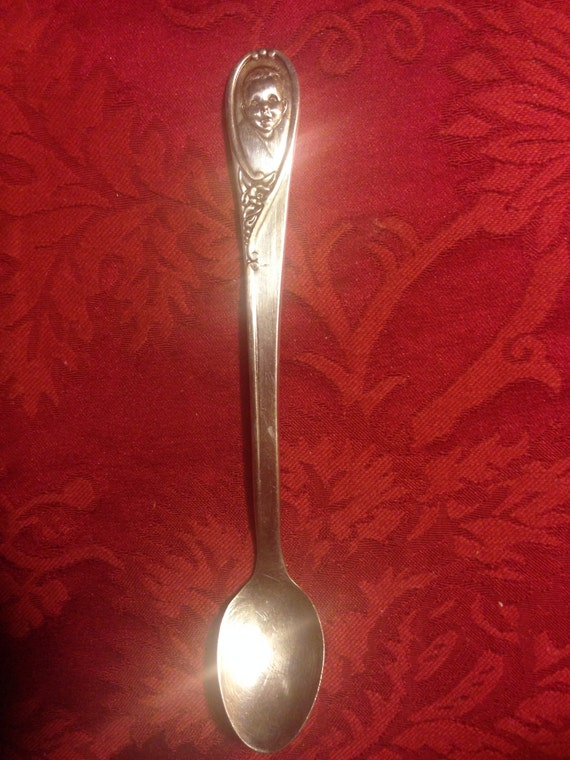
I want to click on spoon handle, so click(260, 309).